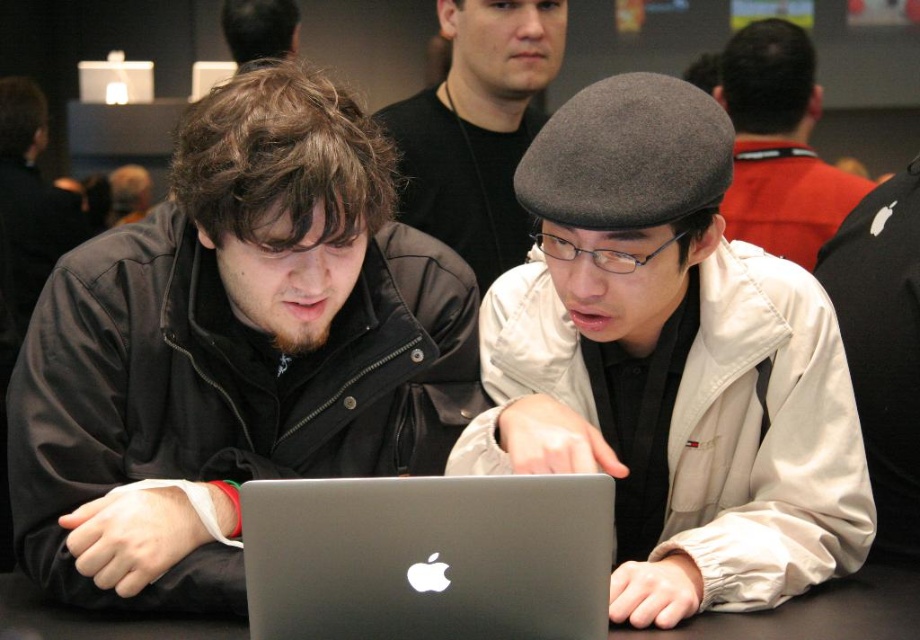
Question: Which point is farther from the camera taking this photo?

Choices:
 (A) (338, 392)
 (B) (472, 152)

Answer: (B)

Question: Can you confirm if black matte table at center is positioned below matte black hair at upper center?

Choices:
 (A) no
 (B) yes

Answer: (B)

Question: Which of these objects is positioned farthest from the matte gray hat at center?

Choices:
 (A) matte black hair at upper center
 (B) sleek silver laptop at center
 (C) matte black shirt at upper center
 (D) black matte table at center

Answer: (A)

Question: Which object appears closest to the camera in this image?

Choices:
 (A) black matte table at center
 (B) matte black shirt at upper center
 (C) gray wool beret at upper right
 (D) sleek silver laptop at center

Answer: (D)

Question: Does gray wool beret at upper right appear over black matte table at center?

Choices:
 (A) no
 (B) yes

Answer: (B)

Question: Is sleek silver laptop at center thinner than gray wool beret at upper right?

Choices:
 (A) yes
 (B) no

Answer: (A)